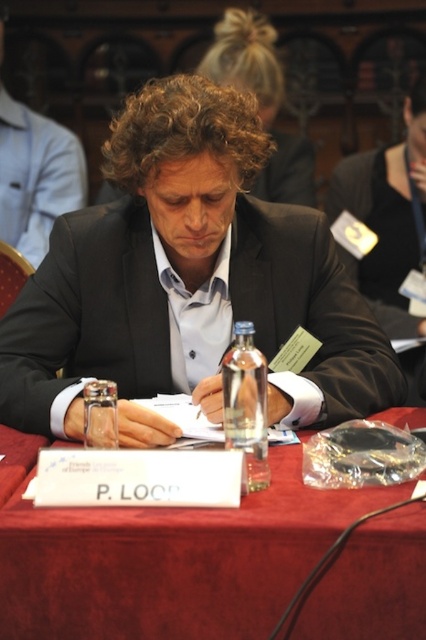
From the picture: Who is higher up, red velvet table at center or matte black suit at center?

Positioned higher is matte black suit at center.

Is red velvet table at center to the left of matte black suit at center from the viewer's perspective?

In fact, red velvet table at center is to the right of matte black suit at center.

Between point (367, 577) and point (0, 52), which one is positioned in front?

Point (367, 577) is in front.

Locate an element on the screen. The width and height of the screenshot is (426, 640). red velvet table at center is located at coordinates (170, 561).

Looking at this image, can you confirm if black matte suit at center is shorter than white paper at center?

In fact, black matte suit at center may be taller than white paper at center.

Is black matte suit at center closer to the viewer compared to white paper at center?

No, it is behind white paper at center.

From the picture: Who is more forward, (x=362, y=358) or (x=95, y=486)?

Positioned in front is point (x=95, y=486).

Where is `black matte suit at center`? This screenshot has width=426, height=640. black matte suit at center is located at coordinates (86, 316).

Is red velvet table at center closer to camera compared to white paper at center?

Yes, red velvet table at center is closer to the viewer.

Is point (114, 600) less distant than point (109, 481)?

Yes, it is.

At what (x,y) coordinates should I click in order to perform the action: click on red velvet table at center. Please return your answer as a coordinate pair (x, y). This screenshot has height=640, width=426. Looking at the image, I should click on (170, 561).